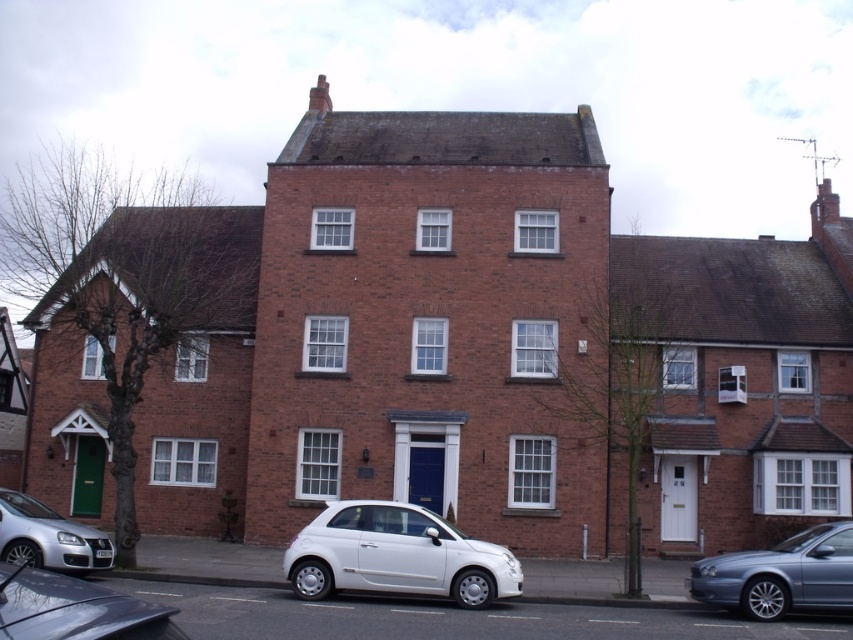
Does metallic gray sedan at lower right appear on the right side of metallic gray hatchback at lower left?

Indeed, metallic gray sedan at lower right is positioned on the right side of metallic gray hatchback at lower left.

Identify the location of metallic gray sedan at lower right. (780, 573).

Based on the photo, is white matte hatchback at center above metallic gray sedan at lower right?

Yes.

Can you confirm if white matte hatchback at center is positioned to the right of metallic gray sedan at lower right?

No, white matte hatchback at center is not to the right of metallic gray sedan at lower right.

The height and width of the screenshot is (640, 853). Describe the element at coordinates (396, 556) in the screenshot. I see `white matte hatchback at center` at that location.

Where is `white matte hatchback at center`? white matte hatchback at center is located at coordinates (396, 556).

Is metallic gray sedan at lower right behind silver metallic hatchback at lower left?

No.

Does metallic gray sedan at lower right have a greater width compared to silver metallic hatchback at lower left?

Yes.

The width and height of the screenshot is (853, 640). Identify the location of metallic gray sedan at lower right. (780, 573).